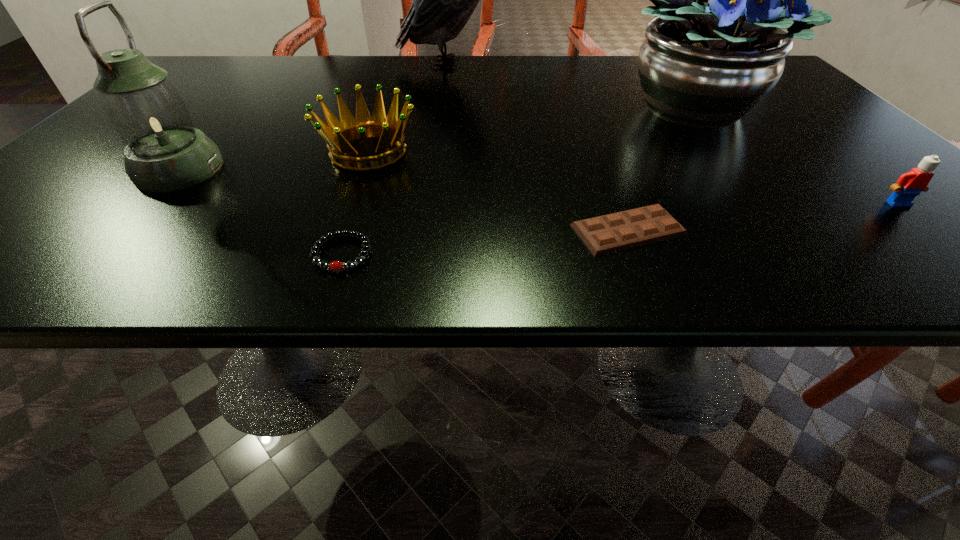
Identify the location of vacant space located 0.210m on the back of the lantern. (240, 102).

Locate an element on the screen. vacant space located 0.210m on the back of the crown is located at coordinates (392, 87).

Locate an element on the screen. This screenshot has height=540, width=960. vacant space positioned on the face of the Lego is located at coordinates (924, 227).

Identify the location of vacant space located on the left of the chocolate bar. The height and width of the screenshot is (540, 960). (339, 230).

Where is `free space located 0.170m on the back of the bracelet`? The image size is (960, 540). free space located 0.170m on the back of the bracelet is located at coordinates (369, 173).

This screenshot has height=540, width=960. I want to click on parrot situated at the far edge, so click(443, 0).

Find the location of a particular element. This screenshot has width=960, height=540. bouquet present at the far edge is located at coordinates (716, 49).

Locate an element on the screen. chocolate bar situated at the near edge is located at coordinates (615, 232).

Identify the location of bracelet positioned at the near edge. (334, 266).

Find the location of a particular element. Image resolution: width=960 pixels, height=540 pixels. object present at the left edge is located at coordinates (164, 152).